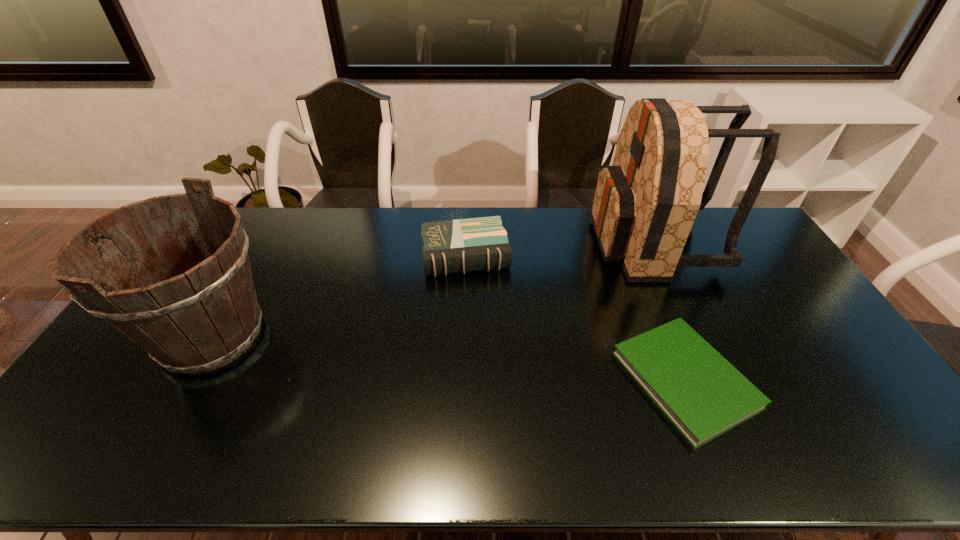
At what (x,y) coordinates should I click in order to perform the action: click on vacant space located 0.170m on the front of the bucket. Please return your answer as a coordinate pair (x, y). Looking at the image, I should click on (140, 462).

Identify the location of free space located 0.100m on the front of the farther paperback book. This screenshot has width=960, height=540. (464, 301).

Image resolution: width=960 pixels, height=540 pixels. In order to click on vacant space located 0.110m on the back of the nearer paperback book in this screenshot , I will do `click(654, 298)`.

Locate an element on the screen. Image resolution: width=960 pixels, height=540 pixels. backpack that is at the far edge is located at coordinates (645, 204).

Identify the location of paperback book at the far edge. Image resolution: width=960 pixels, height=540 pixels. (463, 245).

Locate an element on the screen. This screenshot has height=540, width=960. object that is at the near edge is located at coordinates (704, 395).

The image size is (960, 540). What are the coordinates of `object at the left edge` in the screenshot? It's located at (205, 315).

Where is `blank space at the far edge of the desktop`? This screenshot has width=960, height=540. blank space at the far edge of the desktop is located at coordinates (272, 210).

I want to click on free space at the near edge of the desktop, so click(x=348, y=452).

Locate an element on the screen. This screenshot has height=540, width=960. free point between the shorter paperback book and the second shortest object is located at coordinates (576, 317).